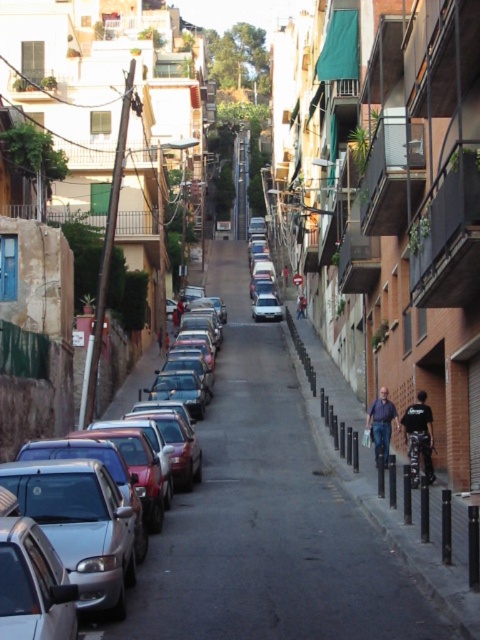
Does shiny silver sedan at left lie in front of black leather jacket at lower right?

Yes, it is.

Which is behind, point (230, 310) or point (420, 419)?

Positioned behind is point (230, 310).

Which is in front, point (140, 589) or point (424, 397)?

Point (140, 589) is in front.

Where is `shiny silver sedan at left`? Image resolution: width=480 pixels, height=640 pixels. shiny silver sedan at left is located at coordinates (205, 541).

You are a GUI agent. You are given a task and a screenshot of the screen. Output one action in this format:
    pyautogui.click(x=<x>, y=<y>)
    Task: Click on the black leather jacket at lower right
    Image resolution: width=480 pixels, height=640 pixels.
    Given the screenshot: What is the action you would take?
    pyautogui.click(x=419, y=436)

Who is higher up, black leather jacket at lower right or dark blue jeans at right?

black leather jacket at lower right is higher up.

Is point (420, 420) closer to viewer compared to point (380, 440)?

Yes, point (420, 420) is closer to viewer.

Where is `black leather jacket at lower right`? black leather jacket at lower right is located at coordinates (419, 436).

Does silver metallic car at center come behind dark blue jeans at center?

No.

Consider the image. Does silver metallic car at center have a greater width compared to dark blue jeans at center?

Yes.

Identify the location of silver metallic car at center. (263, 275).

Locate an element on the screen. silver metallic car at center is located at coordinates (263, 275).